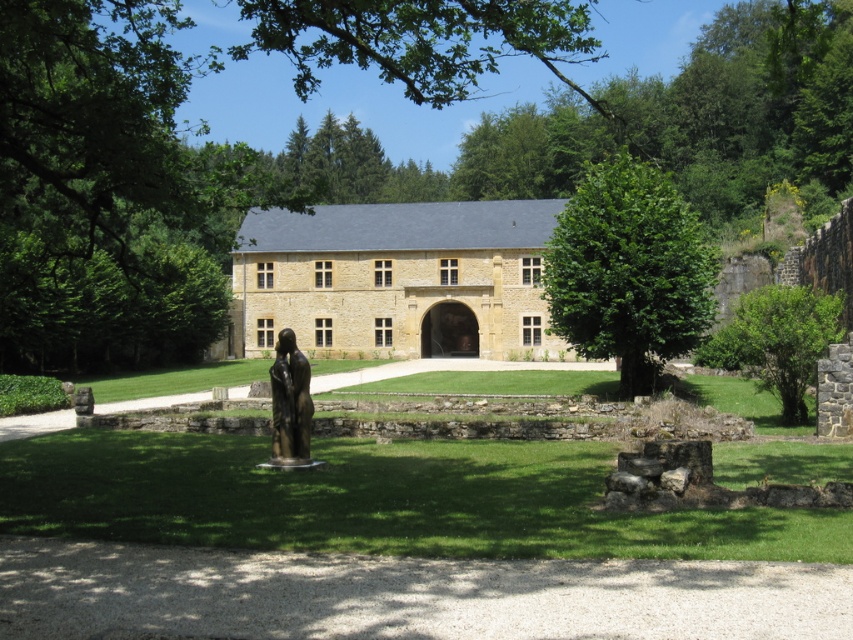
You are planning to place a new bench in the scene so that it is equidistant from both the green leafy tree at center and the bronze statue at center. Given their current positions, what is the minimum distance the bench must be placed from each of them to achieve this?

The bench must be placed exactly halfway between the green leafy tree at center and the bronze statue at center. Since they are 22.92 meters apart, the minimum distance from each would be 11.46 meters.

You are a visitor approaching the stone building and notice the green leafy tree at center and the bronze statue at center. Which object is positioned higher in the scene?

The green leafy tree at center is located above the bronze statue at center, so it is positioned higher in the scene.